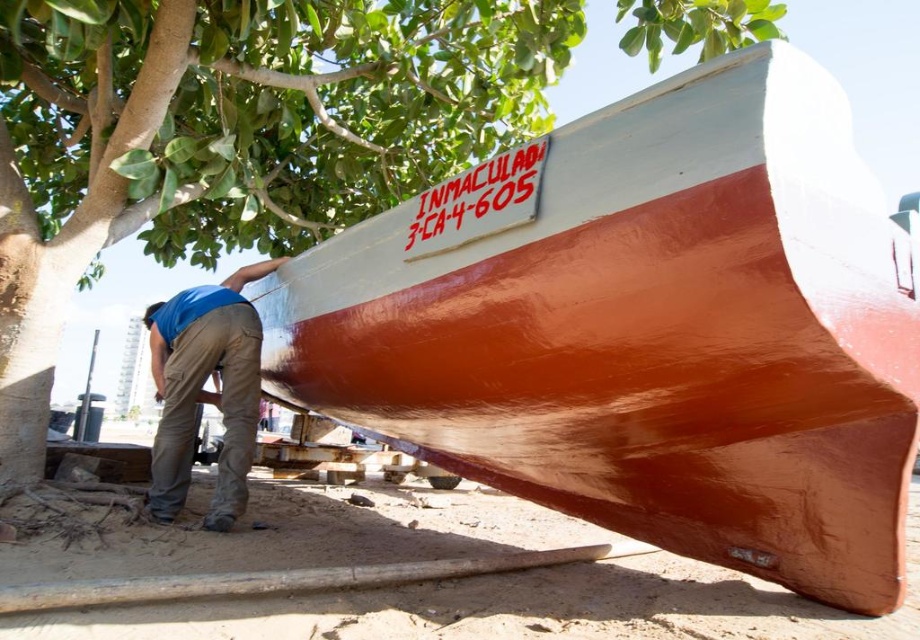
Consider the image. You are a marine inspector standing at the origin point of the image coordinate system. You need to locate the shiny orange hull at center. What are its coordinates?

The coordinates of the shiny orange hull at center are at point (645,328).

You are standing at the origin point of the image coordinate system. The shiny orange hull at center is located at point 0.514, 0.702. If you want to walk towards it, in which direction should you move?

Since the shiny orange hull at center is located at coordinates (645, 328), you should move towards the center of the image to reach it.